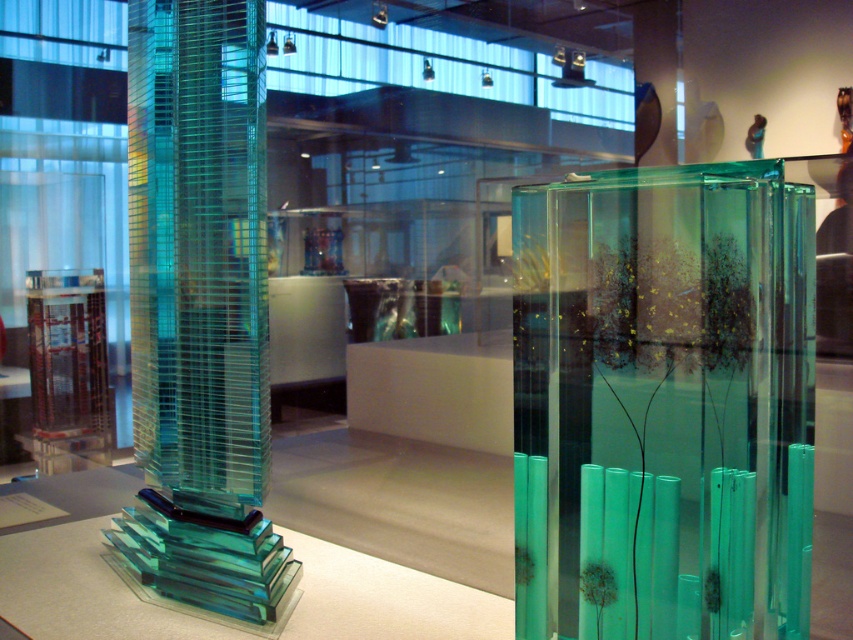
Question: Which point is farther to the camera?

Choices:
 (A) (584, 353)
 (B) (456, 570)

Answer: (B)

Question: Is translucent glass tower at left closer to the viewer compared to transparent glass table at center?

Choices:
 (A) no
 (B) yes

Answer: (A)

Question: Among these points, which one is farthest from the camera?

Choices:
 (A) pyautogui.click(x=238, y=166)
 (B) pyautogui.click(x=735, y=305)
 (C) pyautogui.click(x=79, y=609)

Answer: (C)

Question: Can you confirm if translucent glass tower at left is bigger than transparent glass table at center?

Choices:
 (A) no
 (B) yes

Answer: (B)

Question: Which point is farther to the camera?

Choices:
 (A) (238, 204)
 (B) (383, 604)

Answer: (B)

Question: Does transparent glass sculpture at right appear over transparent glass table at center?

Choices:
 (A) no
 (B) yes

Answer: (B)